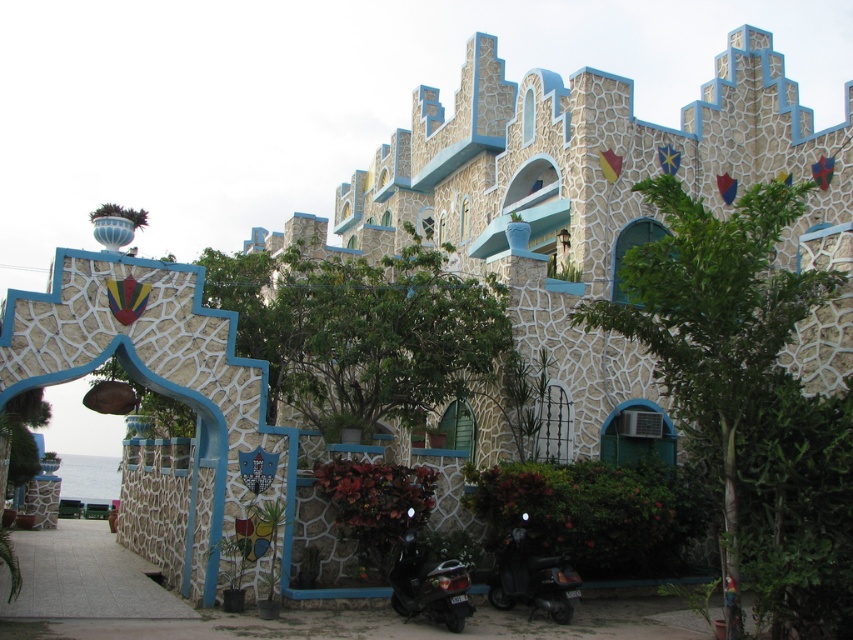
Question: Which of the following is the closest to the observer?

Choices:
 (A) shiny black scooter at lower center
 (B) black glossy scooter at lower right

Answer: (A)

Question: Does black glossy scooter at lower right have a lesser width compared to shiny black scooter at lower center?

Choices:
 (A) no
 (B) yes

Answer: (B)

Question: Which object is closer to the camera taking this photo?

Choices:
 (A) shiny black scooter at lower center
 (B) black glossy scooter at lower right

Answer: (A)

Question: Considering the relative positions of black glossy scooter at lower right and shiny black scooter at lower center in the image provided, where is black glossy scooter at lower right located with respect to shiny black scooter at lower center?

Choices:
 (A) left
 (B) right

Answer: (B)

Question: Is black glossy scooter at lower right above shiny black scooter at lower center?

Choices:
 (A) no
 (B) yes

Answer: (B)